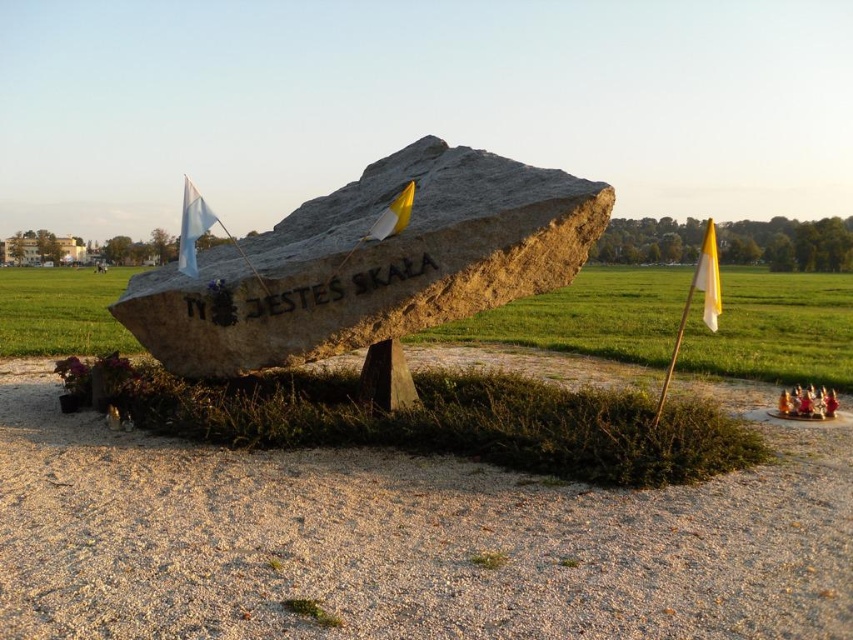
Question: Which point is farther from the camera taking this photo?

Choices:
 (A) (479, 189)
 (B) (815, 356)

Answer: (B)

Question: Which of the following is the closest to the observer?

Choices:
 (A) (451, 298)
 (B) (721, 490)
 (C) (653, 362)

Answer: (B)

Question: Can you confirm if dirt gravel at center is smaller than gray stone boulder at center?

Choices:
 (A) no
 (B) yes

Answer: (B)

Question: Which of these objects is positioned closest to the gray stone boulder at center?

Choices:
 (A) dirt gravel at center
 (B) natural stone rock at center

Answer: (A)

Question: Does gray stone boulder at center have a larger size compared to natural stone rock at center?

Choices:
 (A) yes
 (B) no

Answer: (B)

Question: Does dirt gravel at center appear under gray stone boulder at center?

Choices:
 (A) no
 (B) yes

Answer: (B)